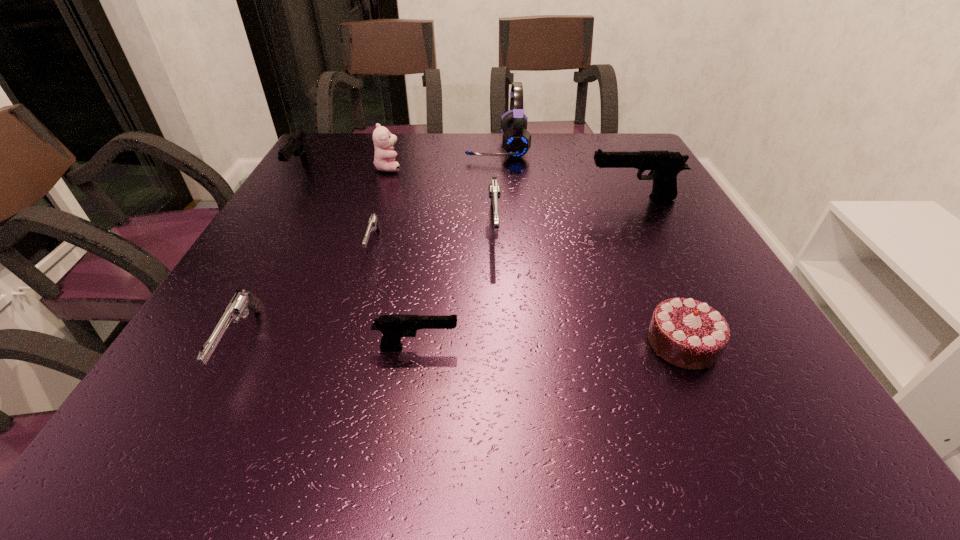
The width and height of the screenshot is (960, 540). I want to click on chocolate cake, so click(689, 334).

Find the location of a particular element. the nearest silver pistol is located at coordinates (241, 302).

Locate an element on the screen. Image resolution: width=960 pixels, height=540 pixels. the fifth pistol from right to left is located at coordinates (241, 302).

Find the location of a particular element. The width and height of the screenshot is (960, 540). the second silver pistol from right to left is located at coordinates 373,224.

Where is `the smallest silver pistol`? This screenshot has height=540, width=960. the smallest silver pistol is located at coordinates (373, 224).

Find the location of a particular element. The height and width of the screenshot is (540, 960). blank space located on the ear cushions of the headset is located at coordinates (391, 147).

Where is `free region located on the ear cushions of the headset`? free region located on the ear cushions of the headset is located at coordinates (435, 147).

The image size is (960, 540). What are the coordinates of `vacant area located on the ear cushions of the headset` in the screenshot? It's located at (373, 147).

Locate an element on the screen. free spot located on the front-facing side of the biggest black pistol is located at coordinates (441, 198).

Where is `vacant area situated 0.180m on the front-facing side of the biggest black pistol`? vacant area situated 0.180m on the front-facing side of the biggest black pistol is located at coordinates (514, 198).